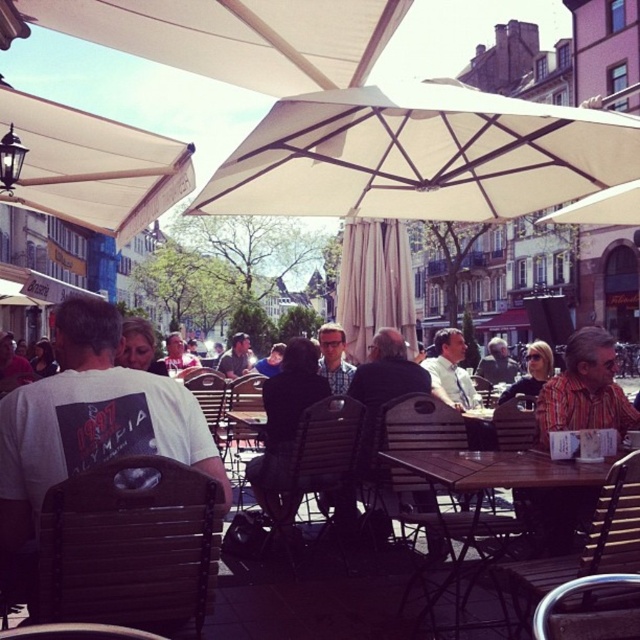
You are standing at the entrance of the outdoor cafe and want to find the wooden table at center. According to the coordinates provided, in which direction should you walk to reach it?

The wooden table at center is located at coordinates point (496, 470). Since the coordinates are both greater than 0.5, it means the table is positioned towards the lower right area of the image. Therefore, you should walk towards the lower right direction to reach the wooden table at center.

You are a person who wants to place the dark gray fabric jacket at center on the wooden table at center. Based on the scene description, will the jacket fit on the table?

The wooden table at center has a lesser height compared to dark gray fabric jacket at center. Since the table is shorter than the jacket, the jacket might not fit properly on the table unless it is folded or arranged in a way that accommodates its height.

You are a photographer planning to take a photo of the matte black jacket at center. You want to ensure the white fabric umbrella at upper center does not block the jacket in the shot. Based on their sizes, is it possible to position yourself so that the umbrella doesn not cover the jacket?

The white fabric umbrella at upper center is wider than the matte black jacket at center. Since the umbrella is larger, positioning yourself carefully might allow you to frame the shot so that the umbrella does not fully cover the jacket, but its size could still make it challenging depending on the angle and distance.